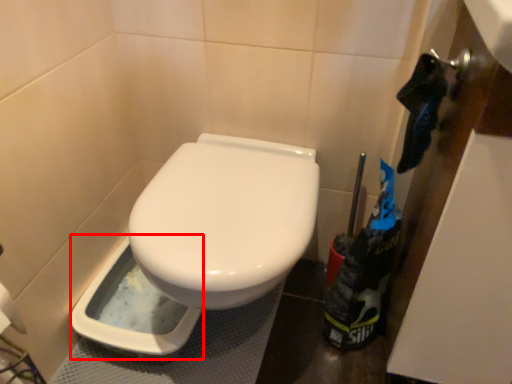
Question: Observing the image, what is the correct spatial positioning of bidet (annotated by the red box) in reference to garbage?

Choices:
 (A) left
 (B) right

Answer: (A)